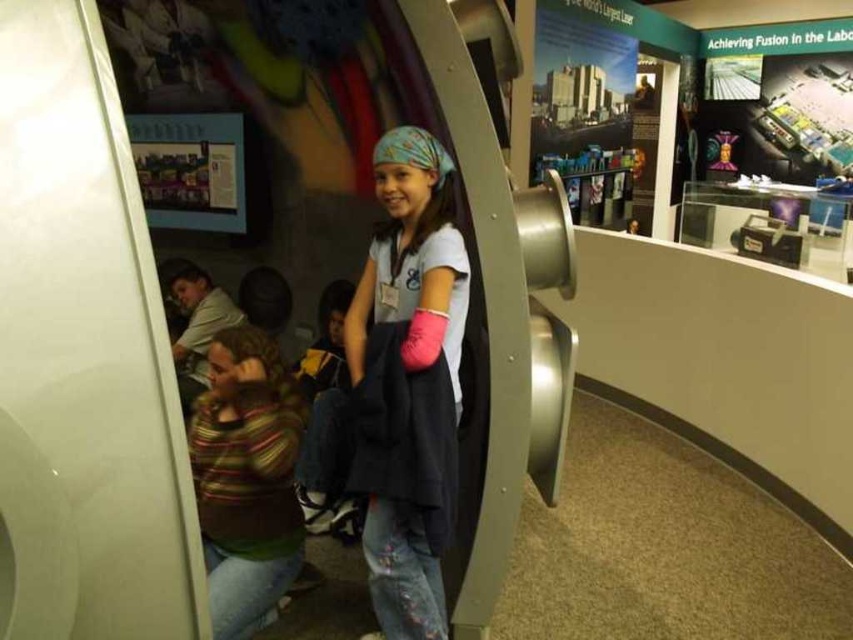
Question: From the image, what is the correct spatial relationship of white matte shirt at center in relation to striped sweater at lower left?

Choices:
 (A) below
 (B) above

Answer: (B)

Question: Considering the relative positions of white matte shirt at center and striped sweater at lower left in the image provided, where is white matte shirt at center located with respect to striped sweater at lower left?

Choices:
 (A) left
 (B) right

Answer: (B)

Question: Which point is closer to the camera?

Choices:
 (A) (369, 484)
 (B) (289, 516)

Answer: (A)

Question: Which point is farther to the camera?

Choices:
 (A) striped sweater at lower left
 (B) white matte shirt at center

Answer: (A)

Question: Is white matte shirt at center to the right of striped sweater at lower left from the viewer's perspective?

Choices:
 (A) yes
 (B) no

Answer: (A)